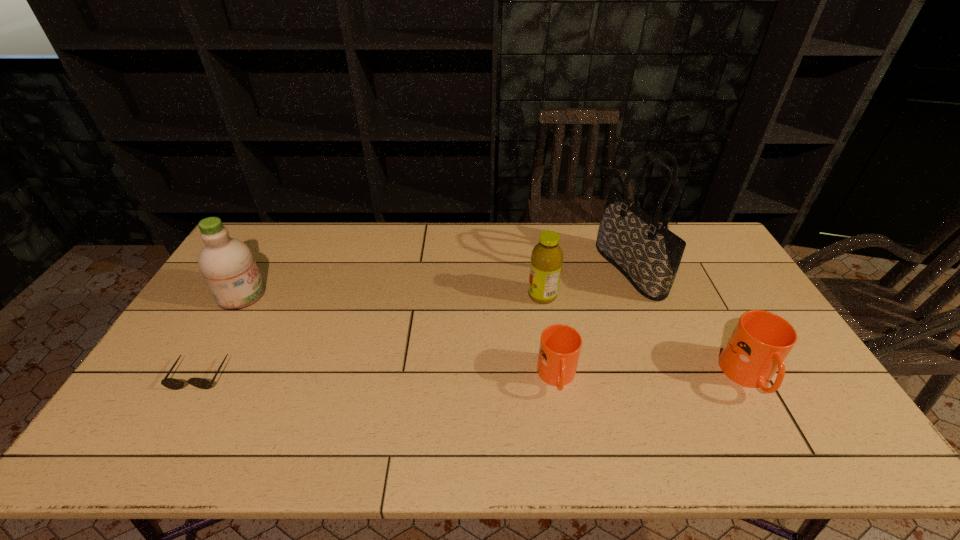
In the current image, all mugs are evenly spaced. To maintain this equal spacing, where should an additional mug be placed on the left? Please point out a free spot. Please provide its 2D coordinates. Your answer should be formatted as a tuple, i.e. [(x, y)], where the tuple contains the x and y coordinates of a point satisfying the conditions above.

[(365, 378)]